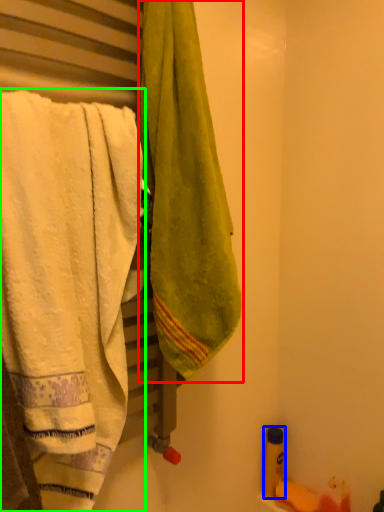
Question: Considering the real-world distances, which object is closest to towel (highlighted by a red box)? toiletry (highlighted by a blue box) or towel (highlighted by a green box).

Choices:
 (A) toiletry
 (B) towel

Answer: (B)